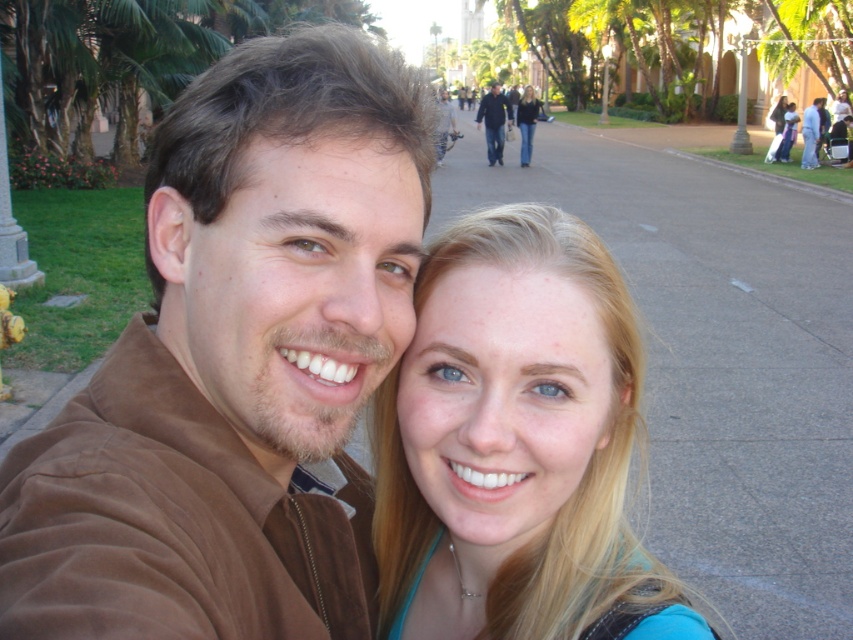
You are a photographer trying to frame a shot that includes both the brown suede jacket at upper left and the blonde hair at upper center. Since the jacket is narrower than the hair, which object should you adjust your camera angle to focus on first to ensure both fit in the frame?

The brown suede jacket at upper left is narrower than the blonde hair at upper center, so you should focus on the wider object, the blonde hair at upper center first to ensure both fit in the frame.

You are taking a photo of two people standing in a park. You notice the brown suede jacket at upper left and the blonde hair at upper center. Which object is positioned more to the left in the image?

The brown suede jacket at upper left is positioned to the left of the blonde hair at upper center, so the brown suede jacket at upper left is more to the left.

You are a photographer standing at the camera position. You want to ensure both the man and the woman in the image are clearly visible in the photo. Given the distance between the blonde hair at center and the camera is 1.02 meters, can you estimate if the entire group fits within the camera frame?

The distance between the blonde hair at center and the camera is 1.02 meters. Since the camera frame typically accommodates subjects within a reasonable distance, the entire group likely fits within the frame as they are positioned close to the camera.